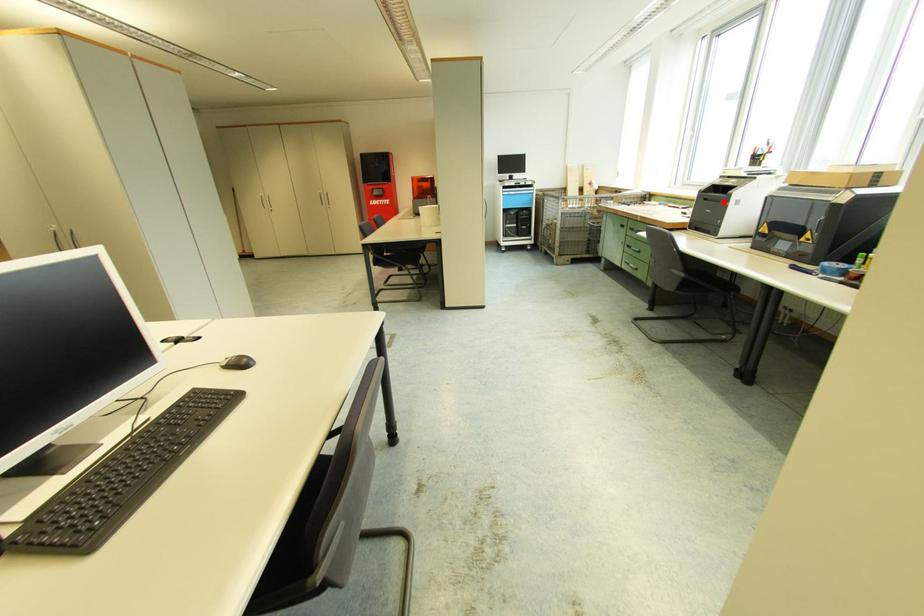
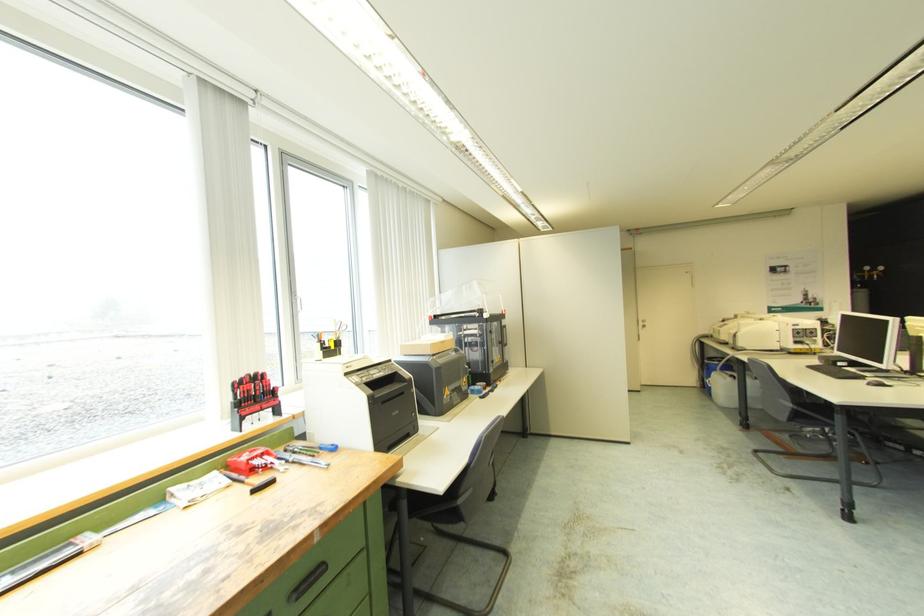
Where in the second image is the point corresponding to the highlighted location from the first image?

(407, 394)